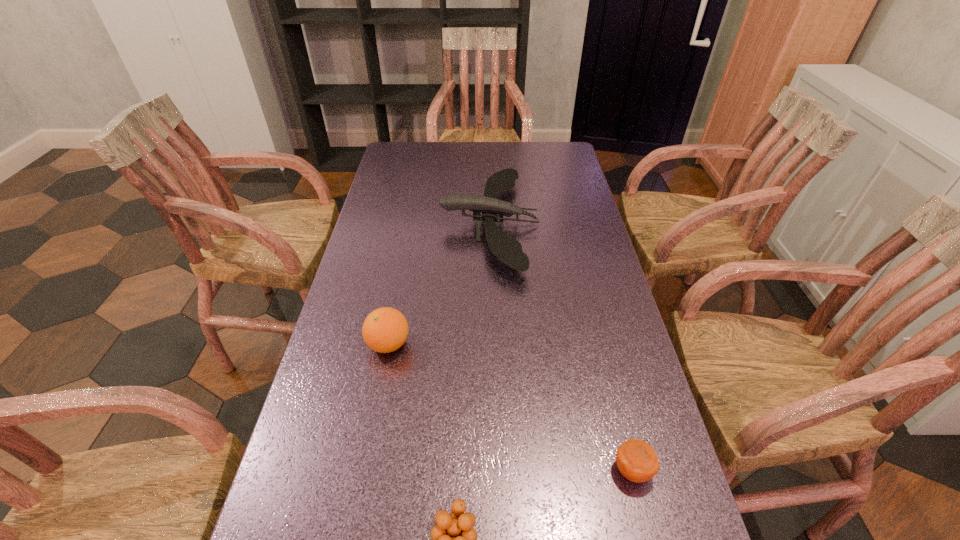
In order to click on the third closest object relative to the rightmost orange fruit in this screenshot , I will do `click(507, 249)`.

Identify which orange fruit is the third closest to the farthest object. Please provide its 2D coordinates. Your answer should be formatted as a tuple, i.e. [(x, y)], where the tuple contains the x and y coordinates of a point satisfying the conditions above.

[(454, 539)]

You are a GUI agent. You are given a task and a screenshot of the screen. Output one action in this format:
    pyautogui.click(x=<x>, y=<y>)
    Task: Click on the second closest orange fruit to the second nearest orange fruit
    Image resolution: width=960 pixels, height=540 pixels.
    Given the screenshot: What is the action you would take?
    pyautogui.click(x=384, y=330)

Where is `vacant space that satisfies the following two spatial constraints: 1. at the head of the drone; 2. on the left side of the second tallest orange fruit`? vacant space that satisfies the following two spatial constraints: 1. at the head of the drone; 2. on the left side of the second tallest orange fruit is located at coordinates (496, 470).

This screenshot has height=540, width=960. Find the location of `free space that satisfies the following two spatial constraints: 1. at the head of the third farthest object; 2. on the left side of the farthest object`. free space that satisfies the following two spatial constraints: 1. at the head of the third farthest object; 2. on the left side of the farthest object is located at coordinates (496, 470).

Find the location of a particular element. This screenshot has height=540, width=960. free spot that satisfies the following two spatial constraints: 1. on the front side of the leftmost object; 2. on the left side of the second nearest object is located at coordinates (365, 470).

Identify the location of vacant space that satisfies the following two spatial constraints: 1. at the head of the drone; 2. on the back side of the rightmost orange fruit. (496, 470).

Identify the location of free space that satisfies the following two spatial constraints: 1. on the front side of the leftmost object; 2. on the right side of the second farthest orange fruit. The width and height of the screenshot is (960, 540). (365, 470).

Image resolution: width=960 pixels, height=540 pixels. I want to click on vacant region that satisfies the following two spatial constraints: 1. at the head of the drone; 2. on the right side of the third farthest object, so click(x=496, y=470).